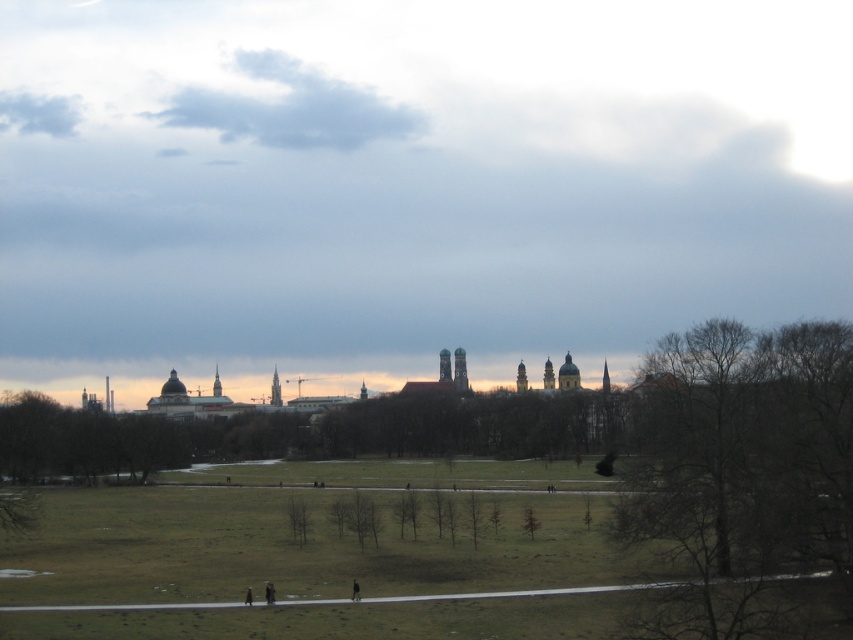
Is bare wood tree at center to the right of dark gray clothing at center from the viewer's perspective?

Indeed, bare wood tree at center is positioned on the right side of dark gray clothing at center.

Which is more to the left, bare wood tree at center or dark gray clothing at center?

dark gray clothing at center is more to the left.

Who is more distant from viewer, (798,451) or (357,580)?

The point (357,580) is behind.

Find the location of `bare wood tree at center`. bare wood tree at center is located at coordinates (740, 468).

Between bare wood tree at center and dark brown leather jacket at lower center, which one has more height?

bare wood tree at center is taller.

Is bare wood tree at center shorter than dark brown leather jacket at lower center?

No.

Is point (834, 515) in front of point (265, 589)?

Yes, point (834, 515) is closer to viewer.

Find the location of a particular element. This screenshot has height=640, width=853. bare wood tree at center is located at coordinates (740, 468).

Which is more to the right, dark brown leather jacket at lower center or dark gray clothing at center?

From the viewer's perspective, dark gray clothing at center appears more on the right side.

Between point (265, 593) and point (358, 586), which one is positioned behind?

Point (358, 586)

Find the location of a particular element. This screenshot has width=853, height=640. dark brown leather jacket at lower center is located at coordinates (270, 593).